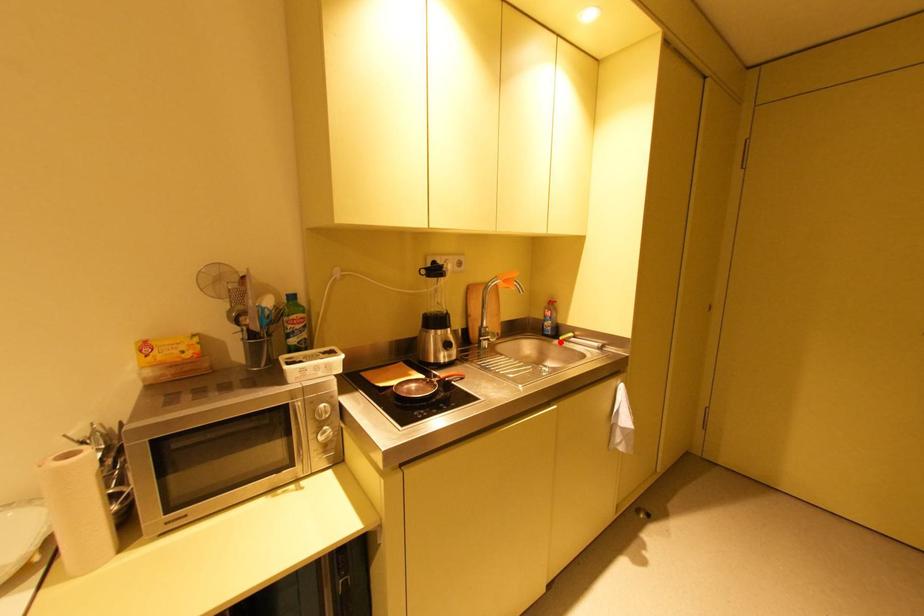
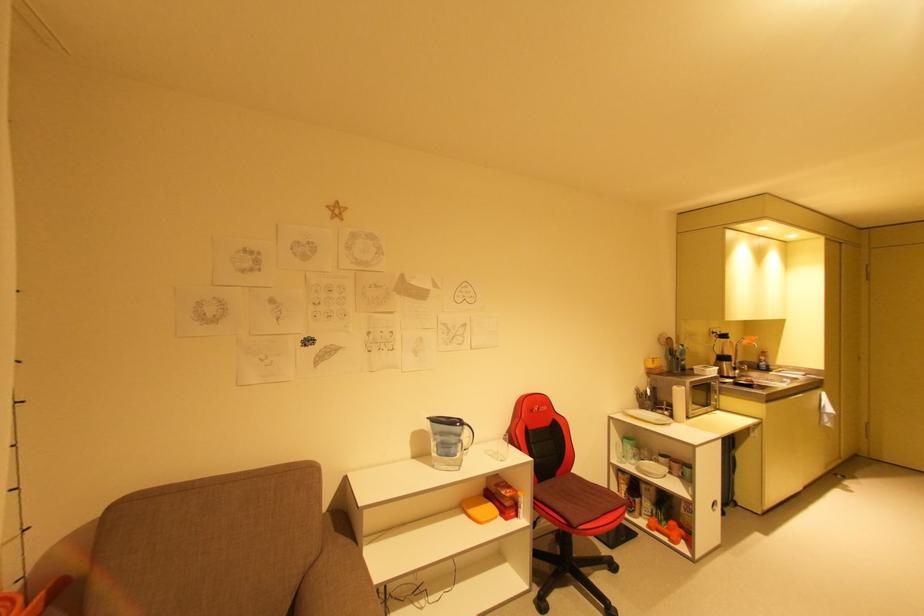
Find the pixel in the second image that matches the highlighted location in the first image.

(776, 373)